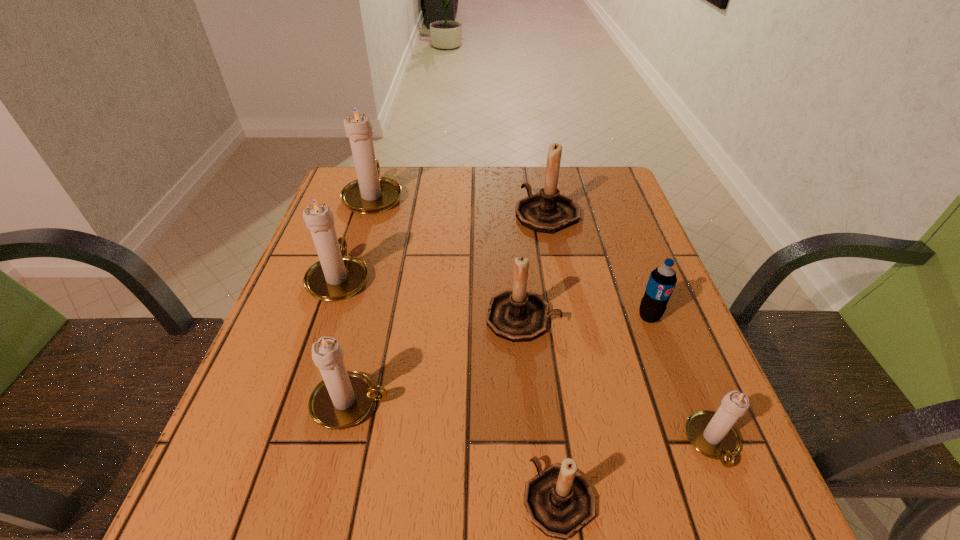
You are a GUI agent. You are given a task and a screenshot of the screen. Output one action in this format:
    pyautogui.click(x=<x>, y=<y>)
    Task: Click on the object that is positioned at the far right corner
    
    Given the screenshot: What is the action you would take?
    pyautogui.click(x=548, y=211)

In the image, there is a desktop. What are the coordinates of `free space at the far edge` in the screenshot? It's located at (449, 175).

The width and height of the screenshot is (960, 540). Identify the location of vacant space at the near edge. (516, 532).

At what (x,y) coordinates should I click in order to perform the action: click on vacant space at the left edge of the desktop. Please return your answer as a coordinate pair (x, y). Image resolution: width=960 pixels, height=540 pixels. Looking at the image, I should click on (370, 258).

Identify the location of free region at the right edge. This screenshot has height=540, width=960. pyautogui.click(x=661, y=441).

You are a GUI agent. You are given a task and a screenshot of the screen. Output one action in this format:
    pyautogui.click(x=<x>, y=<y>)
    Task: Click on the free space at the far left corner of the desktop
    
    Given the screenshot: What is the action you would take?
    (x=348, y=179)

The height and width of the screenshot is (540, 960). I want to click on vacant point at the near left corner, so click(x=221, y=521).

At what (x,y) coordinates should I click in order to perform the action: click on free region at the far right corner. Please return your answer as a coordinate pair (x, y). Looking at the image, I should click on (577, 175).

Identify the location of free area in between the smallest white candle holder and the soda bottle. The image size is (960, 540). (681, 379).

At what (x,y) coordinates should I click in order to perform the action: click on free area in between the second biggest white candle holder and the smallest white candle holder. Please return your answer as a coordinate pair (x, y). This screenshot has height=540, width=960. Looking at the image, I should click on (526, 359).